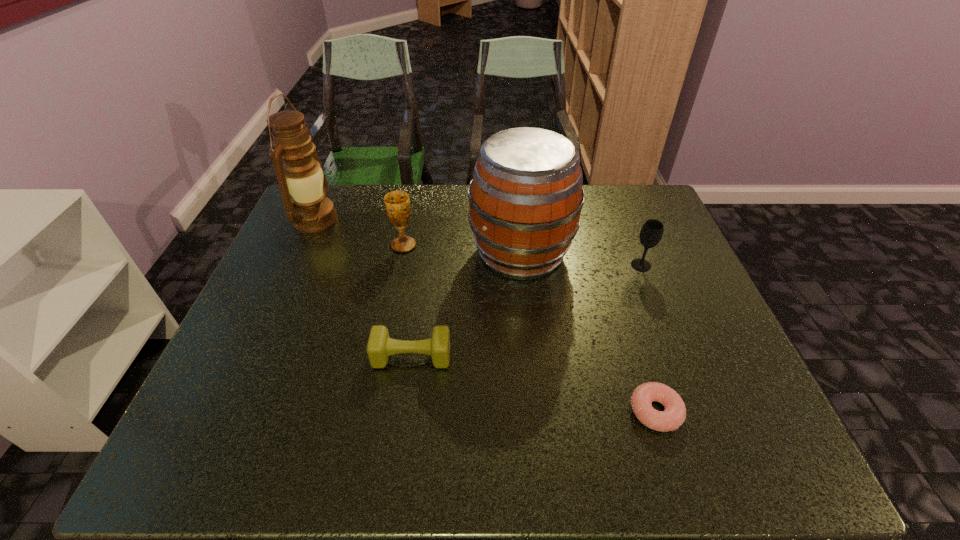
Image resolution: width=960 pixels, height=540 pixels. In order to click on the leftmost object in this screenshot , I will do `click(309, 210)`.

This screenshot has width=960, height=540. I want to click on oil lamp, so click(x=309, y=210).

The image size is (960, 540). I want to click on cider, so click(x=525, y=200).

The height and width of the screenshot is (540, 960). What are the coordinates of `the third object from right to left` in the screenshot? It's located at (525, 200).

Where is `chalice`? chalice is located at coordinates (397, 203).

Find the location of `the rightmost object`. the rightmost object is located at coordinates click(652, 230).

Where is `wineglass`? Image resolution: width=960 pixels, height=540 pixels. wineglass is located at coordinates (652, 230).

The height and width of the screenshot is (540, 960). I want to click on the fifth farthest object, so click(380, 346).

Identify the location of the fifth tallest object. click(380, 346).

This screenshot has height=540, width=960. Identify the location of the second object from right to left. (674, 415).